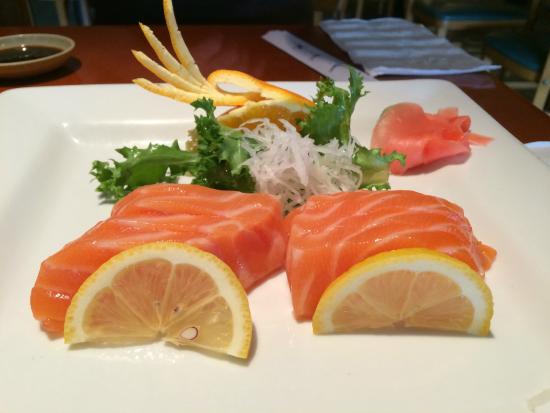
At what (x,y) coordinates should I click in order to perform the action: click on chopsticks. Please return your answer as a coordinate pair (x, y). Looking at the image, I should click on (323, 64).